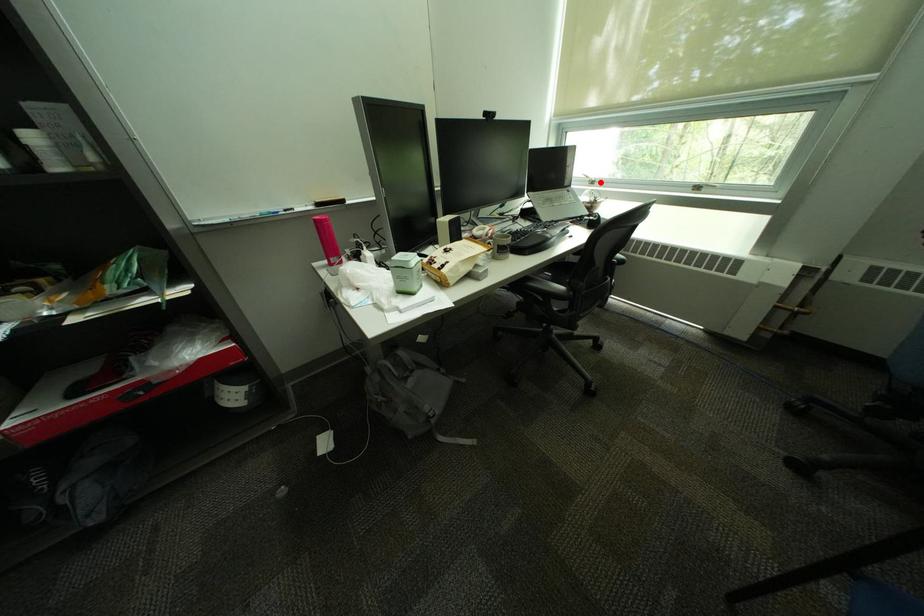
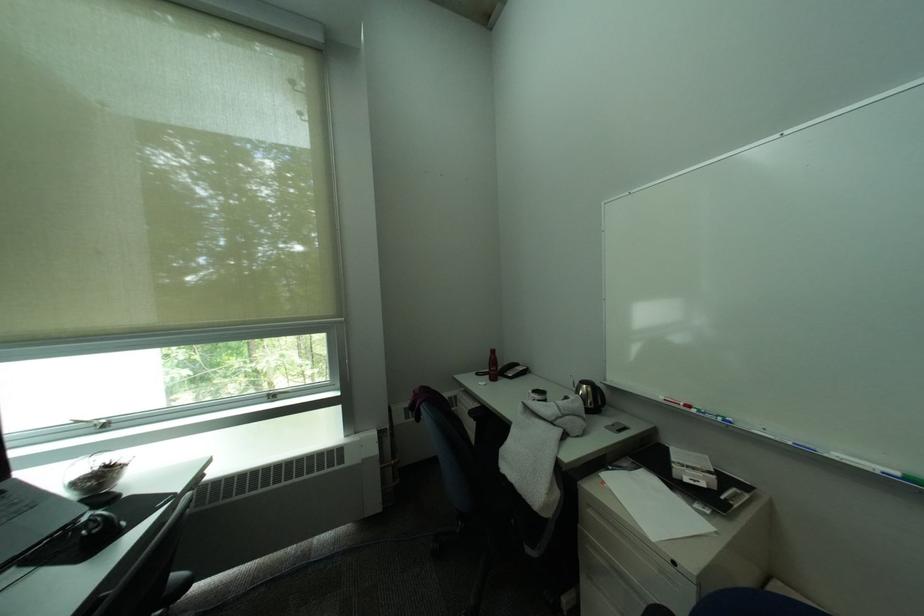
Question: I am providing you with two images of the same scene from different viewpoints. A red point is marked on the first image. Is the red point's position out of view in image 2?

Choices:
 (A) Yes
 (B) No

Answer: (B)